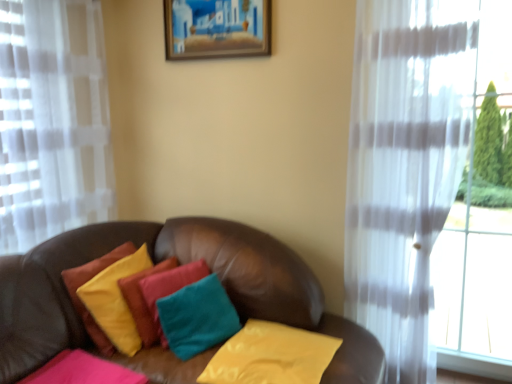
The image size is (512, 384). What are the coordinates of `yellow fabric pillow at center, the 4th pillow positioned from the left` in the screenshot? It's located at click(x=271, y=356).

The width and height of the screenshot is (512, 384). Describe the element at coordinates (115, 301) in the screenshot. I see `velvet yellow pillow at center, the third pillow from the right` at that location.

Identify the location of teal fabric pillow at center, the 2th pillow from the right. (197, 317).

Image resolution: width=512 pixels, height=384 pixels. I want to click on pink velvety pillow at lower left, the first pillow from the left, so click(82, 371).

At what (x,y) coordinates should I click in order to perform the action: click on yellow fabric pillow at center, the 4th pillow positioned from the left. Please return your answer as a coordinate pair (x, y). Looking at the image, I should click on (271, 356).

Which object is further away from the camera, yellow fabric pillow at center, which is the first pillow in right-to-left order, or pink velvety pillow at lower left, the first pillow from the left?

yellow fabric pillow at center, which is the first pillow in right-to-left order.

Based on the photo, looking at the image, does yellow fabric pillow at center, the 4th pillow positioned from the left, seem bigger or smaller compared to pink velvety pillow at lower left, the first pillow from the left?

Considering their sizes, yellow fabric pillow at center, the 4th pillow positioned from the left, takes up more space than pink velvety pillow at lower left, the first pillow from the left.

How different are the orientations of yellow fabric pillow at center, the 4th pillow positioned from the left, and pink velvety pillow at lower left, the first pillow from the left, in degrees?

90.4 degrees.

Based on the photo, who is shorter, yellow fabric pillow at center, the 4th pillow positioned from the left, or pink velvety pillow at lower left, acting as the 4th pillow starting from the right?

With less height is pink velvety pillow at lower left, acting as the 4th pillow starting from the right.

From the image's perspective, which is below, yellow fabric pillow at center, the 4th pillow positioned from the left, or wooden picture frame at upper center?

yellow fabric pillow at center, the 4th pillow positioned from the left, from the image's perspective.

Between yellow fabric pillow at center, which is the first pillow in right-to-left order, and wooden picture frame at upper center, which one has more height?

wooden picture frame at upper center.

From a real-world perspective, is yellow fabric pillow at center, which is the first pillow in right-to-left order, above or below wooden picture frame at upper center?

yellow fabric pillow at center, which is the first pillow in right-to-left order, is situated lower than wooden picture frame at upper center in the real world.

How different are the orientations of yellow fabric pillow at center, the 4th pillow positioned from the left, and wooden picture frame at upper center in degrees?

0.376 degrees separate the facing orientations of yellow fabric pillow at center, the 4th pillow positioned from the left, and wooden picture frame at upper center.

In the scene shown: From their relative heights in the image, would you say yellow fabric pillow at center, the 4th pillow positioned from the left, is taller or shorter than teal fabric pillow at center, the 2th pillow from the right?

Clearly, yellow fabric pillow at center, the 4th pillow positioned from the left, is shorter compared to teal fabric pillow at center, the 2th pillow from the right.

Considering the relative sizes of yellow fabric pillow at center, which is the first pillow in right-to-left order, and teal fabric pillow at center, the 2th pillow from the right, in the image provided, is yellow fabric pillow at center, which is the first pillow in right-to-left order, thinner than teal fabric pillow at center, the 2th pillow from the right,?

No.

Relative to teal fabric pillow at center, which is the 3th pillow in left-to-right order, is yellow fabric pillow at center, the 4th pillow positioned from the left, in front or behind?

yellow fabric pillow at center, the 4th pillow positioned from the left, is in front of teal fabric pillow at center, which is the 3th pillow in left-to-right order.

Which is more to the right, wooden picture frame at upper center or pink velvety pillow at lower left, the first pillow from the left?

wooden picture frame at upper center.

Can you tell me how much wooden picture frame at upper center and pink velvety pillow at lower left, the first pillow from the left, differ in facing direction?

The facing directions of wooden picture frame at upper center and pink velvety pillow at lower left, the first pillow from the left, are 90 degrees apart.

The width and height of the screenshot is (512, 384). Identify the location of picture frame behind the pink velvety pillow at lower left, the first pillow from the left. (217, 28).

Is wooden picture frame at upper center completely or partially outside of pink velvety pillow at lower left, the first pillow from the left?

Yes.

Considering the sizes of objects velvet yellow pillow at center, which is counted as the 2th pillow, starting from the left, and yellow fabric pillow at center, the 4th pillow positioned from the left, in the image provided, who is smaller, velvet yellow pillow at center, which is counted as the 2th pillow, starting from the left, or yellow fabric pillow at center, the 4th pillow positioned from the left,?

yellow fabric pillow at center, the 4th pillow positioned from the left.

Is point (111, 268) positioned before point (250, 360)?

That is False.

In terms of height, does velvet yellow pillow at center, the third pillow from the right, look taller or shorter compared to yellow fabric pillow at center, the 4th pillow positioned from the left?

In the image, velvet yellow pillow at center, the third pillow from the right, appears to be taller than yellow fabric pillow at center, the 4th pillow positioned from the left.

Does velvet yellow pillow at center, the third pillow from the right, turn towards yellow fabric pillow at center, which is the first pillow in right-to-left order?

Yes, velvet yellow pillow at center, the third pillow from the right, faces towards yellow fabric pillow at center, which is the first pillow in right-to-left order.

Which is more to the left, teal fabric pillow at center, which is the 3th pillow in left-to-right order, or velvet yellow pillow at center, the third pillow from the right?

velvet yellow pillow at center, the third pillow from the right.

How different are the orientations of teal fabric pillow at center, which is the 3th pillow in left-to-right order, and velvet yellow pillow at center, which is counted as the 2th pillow, starting from the left, in degrees?

teal fabric pillow at center, which is the 3th pillow in left-to-right order, and velvet yellow pillow at center, which is counted as the 2th pillow, starting from the left, are facing 22.6 degrees away from each other.

Relative to velvet yellow pillow at center, which is counted as the 2th pillow, starting from the left, is teal fabric pillow at center, which is the 3th pillow in left-to-right order, in front or behind?

Clearly, teal fabric pillow at center, which is the 3th pillow in left-to-right order, is in front of velvet yellow pillow at center, which is counted as the 2th pillow, starting from the left.

From a real-world perspective, which object stands above the other?

In real-world perspective, velvet yellow pillow at center, the third pillow from the right, is above.

Do you think teal fabric pillow at center, which is the 3th pillow in left-to-right order, is within wooden picture frame at upper center, or outside of it?

teal fabric pillow at center, which is the 3th pillow in left-to-right order, is spatially situated outside wooden picture frame at upper center.

Can you confirm if teal fabric pillow at center, the 2th pillow from the right, is positioned to the right of wooden picture frame at upper center?

No.

From a real-world perspective, who is located higher, teal fabric pillow at center, the 2th pillow from the right, or wooden picture frame at upper center?

wooden picture frame at upper center is physically above.

The image size is (512, 384). Identify the location of pillow in front of the yellow fabric pillow at center, the 4th pillow positioned from the left. (82, 371).

Where is `pillow to the right of wooden picture frame at upper center`? This screenshot has height=384, width=512. pillow to the right of wooden picture frame at upper center is located at coordinates (271, 356).

From the image, which object appears to be farther from wooden picture frame at upper center, teal fabric pillow at center, the 2th pillow from the right, or pink velvety pillow at lower left, the first pillow from the left?

pink velvety pillow at lower left, the first pillow from the left.

Based on their spatial positions, is wooden picture frame at upper center or yellow fabric pillow at center, the 4th pillow positioned from the left, further from pink velvety pillow at lower left, the first pillow from the left?

wooden picture frame at upper center.

Looking at the image, which one is located further to velvet yellow pillow at center, the third pillow from the right, teal fabric pillow at center, which is the 3th pillow in left-to-right order, or pink velvety pillow at lower left, the first pillow from the left?

teal fabric pillow at center, which is the 3th pillow in left-to-right order.

Looking at the image, which one is located closer to wooden picture frame at upper center, teal fabric pillow at center, which is the 3th pillow in left-to-right order, or yellow fabric pillow at center, the 4th pillow positioned from the left?

teal fabric pillow at center, which is the 3th pillow in left-to-right order, is closer to wooden picture frame at upper center.

Which object lies further to the anchor point yellow fabric pillow at center, which is the first pillow in right-to-left order, velvet yellow pillow at center, the third pillow from the right, or teal fabric pillow at center, which is the 3th pillow in left-to-right order?

velvet yellow pillow at center, the third pillow from the right, lies further to yellow fabric pillow at center, which is the first pillow in right-to-left order, than the other object.

Estimate the real-world distances between objects in this image. Which object is closer to velvet yellow pillow at center, the third pillow from the right, wooden picture frame at upper center or pink velvety pillow at lower left, the first pillow from the left?

Result: pink velvety pillow at lower left, the first pillow from the left, is closer to velvet yellow pillow at center, the third pillow from the right.

Looking at the image, which one is located closer to yellow fabric pillow at center, the 4th pillow positioned from the left, wooden picture frame at upper center or pink velvety pillow at lower left, acting as the 4th pillow starting from the right?

pink velvety pillow at lower left, acting as the 4th pillow starting from the right, is closer to yellow fabric pillow at center, the 4th pillow positioned from the left.

From the image, which object appears to be nearer to velvet yellow pillow at center, which is counted as the 2th pillow, starting from the left, teal fabric pillow at center, the 2th pillow from the right, or yellow fabric pillow at center, which is the first pillow in right-to-left order?

teal fabric pillow at center, the 2th pillow from the right, lies closer to velvet yellow pillow at center, which is counted as the 2th pillow, starting from the left, than the other object.

Locate an element on the screen. This screenshot has width=512, height=384. pillow between pink velvety pillow at lower left, acting as the 4th pillow starting from the right, and teal fabric pillow at center, the 2th pillow from the right is located at coordinates (115, 301).

Image resolution: width=512 pixels, height=384 pixels. In order to click on pillow located between velvet yellow pillow at center, which is counted as the 2th pillow, starting from the left, and yellow fabric pillow at center, the 4th pillow positioned from the left, in the left-right direction in this screenshot , I will do `click(197, 317)`.

I want to click on pillow between wooden picture frame at upper center and teal fabric pillow at center, the 2th pillow from the right, in the vertical direction, so click(115, 301).